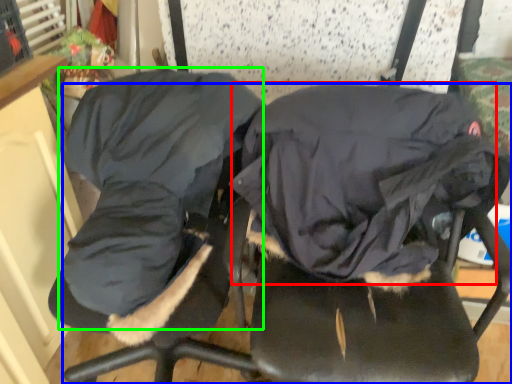
Question: Based on their relative distances, which object is nearer to sleeping bag (highlighted by a red box)? Choose from chair (highlighted by a blue box) and clothing (highlighted by a green box).

Choices:
 (A) chair
 (B) clothing

Answer: (A)